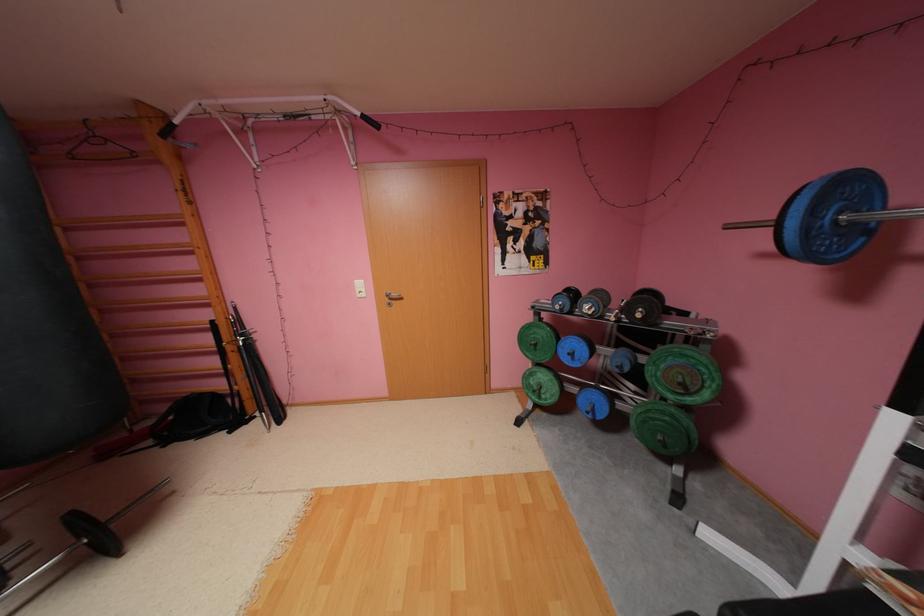
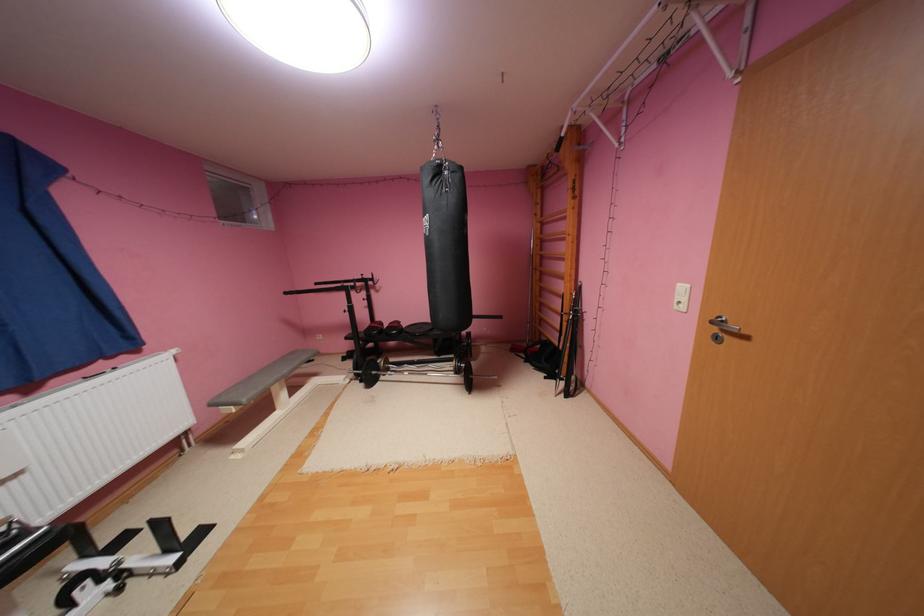
Find the pixel in the second image that matches point (238, 432) in the first image.

(554, 378)